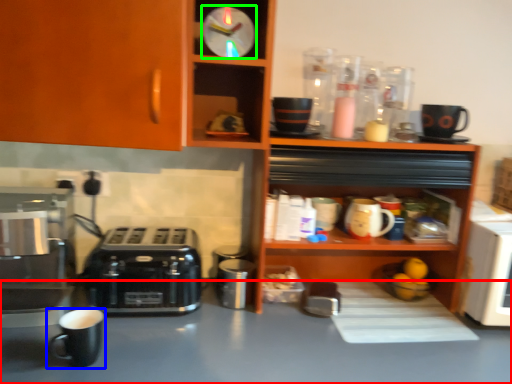
Question: Based on their relative distances, which object is farther from table (highlighted by a red box)? Choose from coffee cup (highlighted by a blue box) and clock (highlighted by a green box).

Choices:
 (A) coffee cup
 (B) clock

Answer: (B)